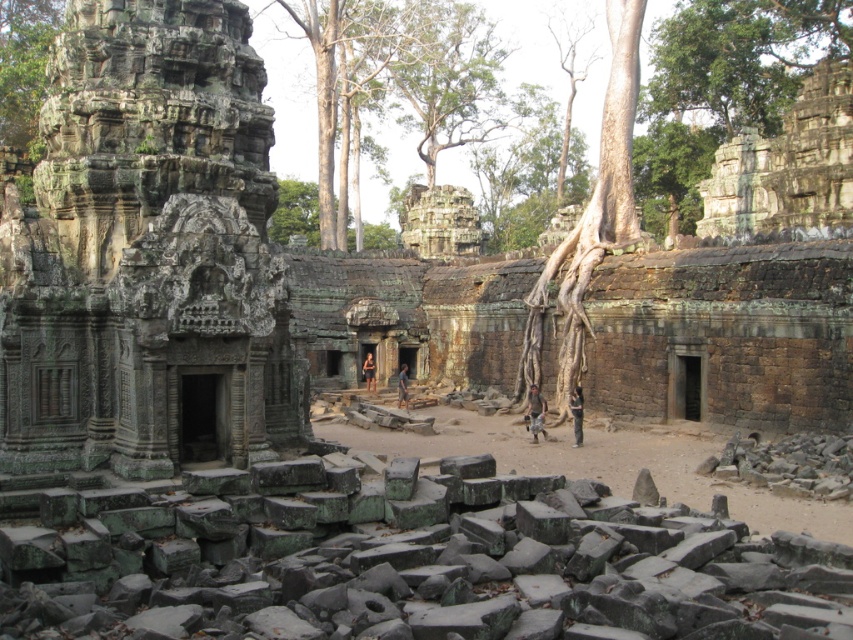
Question: Which point is closer to the camera taking this photo?

Choices:
 (A) (85, 259)
 (B) (4, 84)
 (C) (773, 577)
 (D) (734, 234)

Answer: (C)

Question: Can you confirm if green stone temple at center is bigger than green mossy tree at upper left?

Choices:
 (A) no
 (B) yes

Answer: (A)

Question: Which point appears closest to the camera in this image?

Choices:
 (A) (822, 545)
 (B) (10, 120)
 (C) (743, 163)

Answer: (A)

Question: Which object is closer to the camera taking this photo?

Choices:
 (A) green mossy tree at upper left
 (B) green stone temple at center
 (C) green stone at center
 (D) green stone wall at upper right

Answer: (C)

Question: Does green stone at center lie behind green mossy tree at upper left?

Choices:
 (A) yes
 (B) no

Answer: (B)

Question: Is the position of green stone temple at center less distant than that of green stone wall at upper right?

Choices:
 (A) no
 (B) yes

Answer: (B)